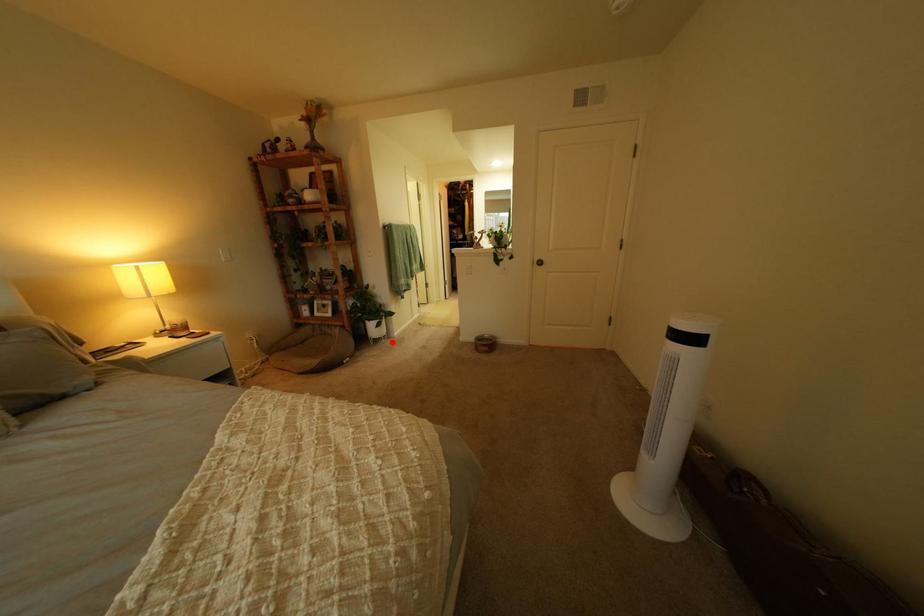
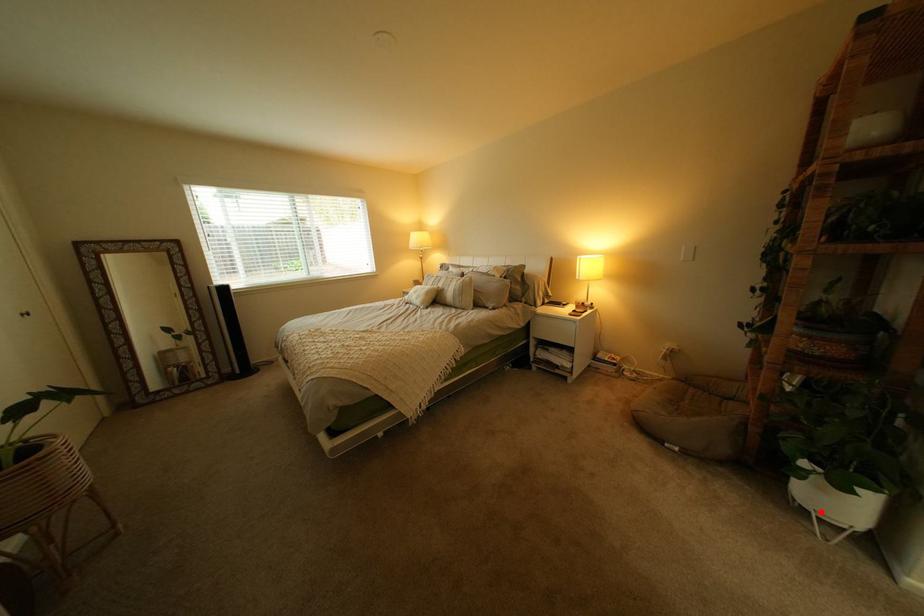
I am providing you with two images of the same scene from different viewpoints. A red point is marked on the first image and another point is marked on the second image. Is the red point in image1 aligned with the point shown in image2?

Yes